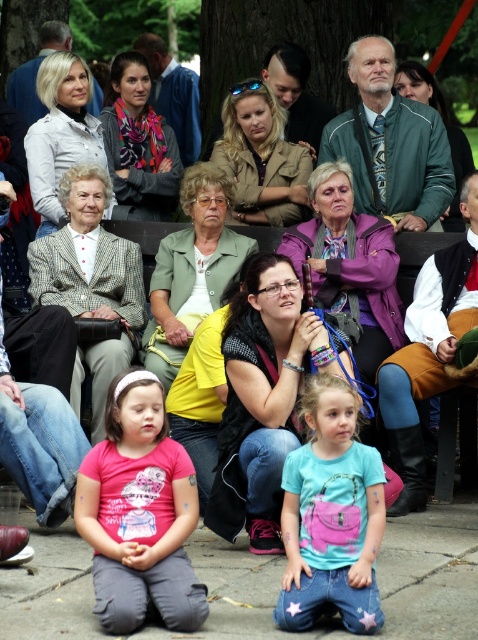
Does purple fabric jacket at center appear on the right side of green fabric jacket at center?

Indeed, purple fabric jacket at center is positioned on the right side of green fabric jacket at center.

From the picture: Between purple fabric jacket at center and green fabric jacket at center, which one appears on the right side from the viewer's perspective?

purple fabric jacket at center is more to the right.

From the picture: Who is more forward, (307, 260) or (184, 256)?

Positioned in front is point (307, 260).

The image size is (478, 640). What are the coordinates of `purple fabric jacket at center` in the screenshot? It's located at (350, 264).

This screenshot has height=640, width=478. What do you see at coordinates (261, 400) in the screenshot?
I see `black leather jacket at center` at bounding box center [261, 400].

Is point (278, 308) closer to camera compared to point (273, 173)?

Yes, point (278, 308) is closer to viewer.

Image resolution: width=478 pixels, height=640 pixels. Describe the element at coordinates (261, 400) in the screenshot. I see `black leather jacket at center` at that location.

Find the location of a particular element. The image size is (478, 640). black leather jacket at center is located at coordinates (261, 400).

Looking at this image, who is lower down, blue denim jeans at lower center or green fabric jacket at center?

Positioned lower is blue denim jeans at lower center.

Measure the distance from blue denim jeans at lower center to green fabric jacket at center.

blue denim jeans at lower center is 23.52 feet away from green fabric jacket at center.

Identify the location of blue denim jeans at lower center. This screenshot has width=478, height=640. (330, 515).